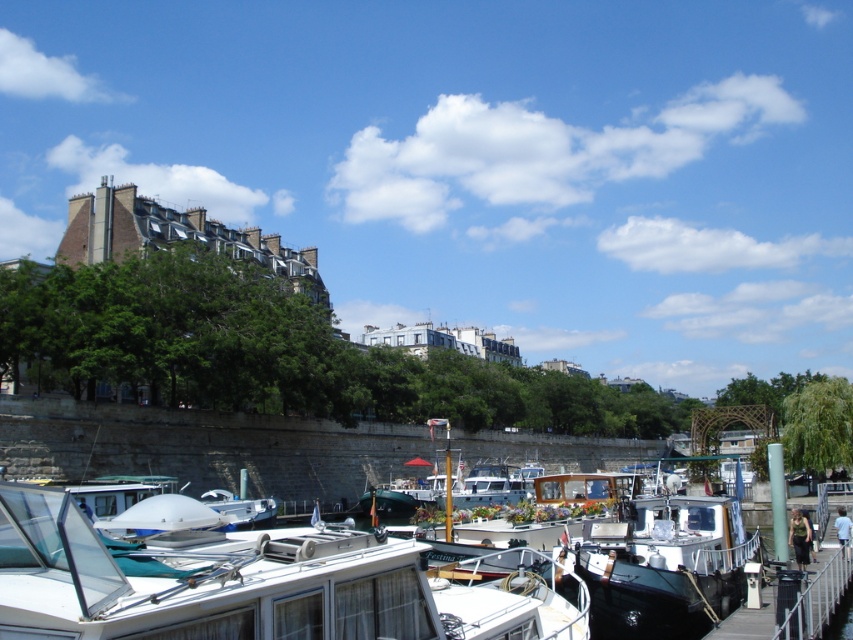
Question: Is white glossy boat at center to the left of shiny black boat at center from the viewer's perspective?

Choices:
 (A) yes
 (B) no

Answer: (A)

Question: Does white glossy boat at center appear over shiny black boat at center?

Choices:
 (A) yes
 (B) no

Answer: (A)

Question: Is white glossy boat at center bigger than shiny black boat at center?

Choices:
 (A) yes
 (B) no

Answer: (A)

Question: Which object appears closest to the camera in this image?

Choices:
 (A) shiny black boat at center
 (B) white glossy boat at center

Answer: (B)

Question: Which point is farther from the camera taking this photo?

Choices:
 (A) (643, 580)
 (B) (265, 632)

Answer: (A)